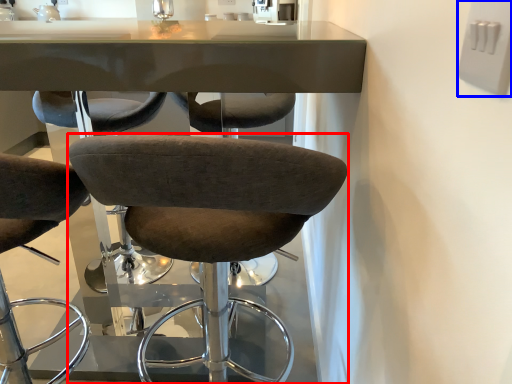
Question: Which object is further to the camera taking this photo, chair (highlighted by a red box) or electric outlet (highlighted by a blue box)?

Choices:
 (A) chair
 (B) electric outlet

Answer: (A)